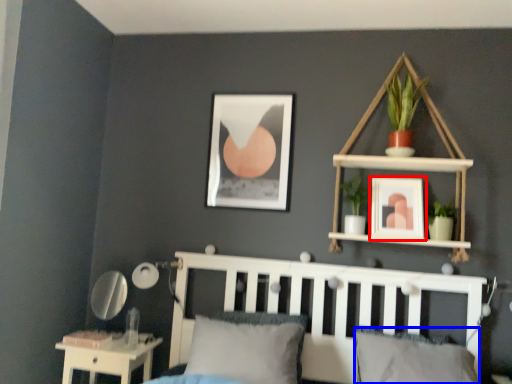
Question: Which object is further to the camera taking this photo, picture frame (highlighted by a red box) or pillow (highlighted by a blue box)?

Choices:
 (A) picture frame
 (B) pillow

Answer: (A)